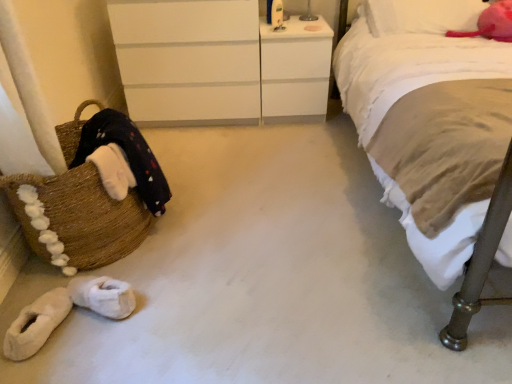
At what (x,y) coordinates should I click in order to perform the action: click on free space in front of white fluffy slippers at lower left, placed as the 2th footwear when sorted from left to right. Please return your answer as a coordinate pair (x, y). This screenshot has width=512, height=384. Looking at the image, I should click on [x=92, y=347].